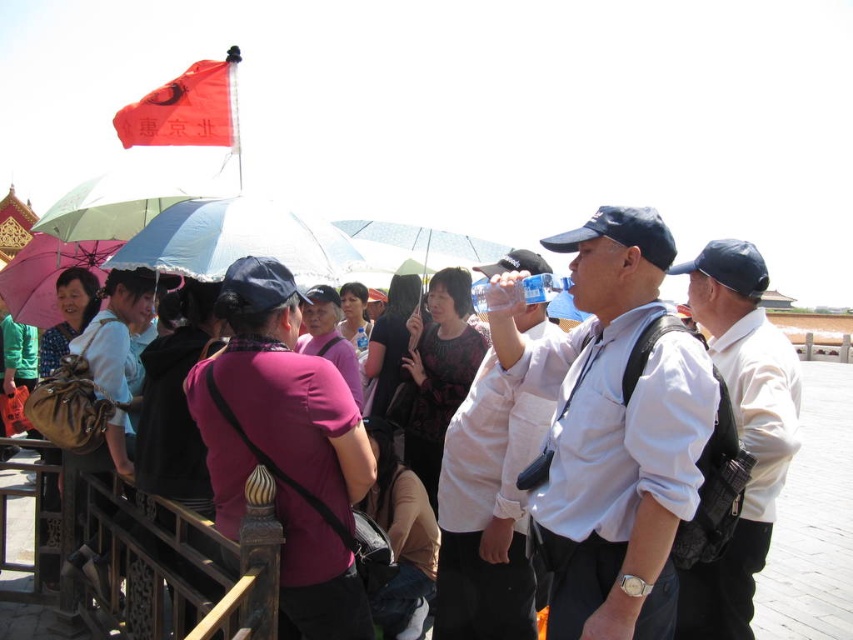
Does point (466, 627) come closer to viewer compared to point (102, 173)?

Yes.

You are a GUI agent. You are given a task and a screenshot of the screen. Output one action in this format:
    pyautogui.click(x=<x>, y=<y>)
    Task: Click on the white matte shirt at center
    This screenshot has height=640, width=853.
    Given the screenshot: What is the action you would take?
    pyautogui.click(x=486, y=512)

Where is `white matte shirt at center`? The image size is (853, 640). white matte shirt at center is located at coordinates (486, 512).

Identify the location of pink fabric umbrella at upper left. (47, 275).

Does pink fabric umbrella at upper left appear over pink fabric shirt at center?

Yes.

Between point (54, 292) and point (312, 285), which one is positioned in front?

Point (54, 292) is in front.

The height and width of the screenshot is (640, 853). Find the location of `pink fabric umbrella at upper left`. pink fabric umbrella at upper left is located at coordinates (47, 275).

Measure the distance from green matte umbrella at upper left to pink fabric umbrella at upper left.

A distance of 23.41 feet exists between green matte umbrella at upper left and pink fabric umbrella at upper left.

Who is positioned more to the left, green matte umbrella at upper left or pink fabric umbrella at upper left?

Positioned to the left is pink fabric umbrella at upper left.

The width and height of the screenshot is (853, 640). Identify the location of green matte umbrella at upper left. pyautogui.click(x=120, y=204).

Locate an element on the screen. Image resolution: width=853 pixels, height=640 pixels. green matte umbrella at upper left is located at coordinates (120, 204).